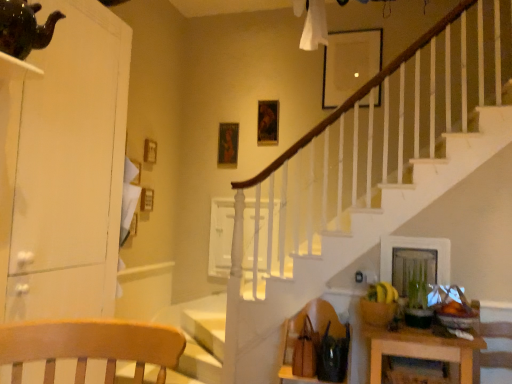
Question: Is green matte plant at lower right taller or shorter than wooden table at lower right?

Choices:
 (A) short
 (B) tall

Answer: (A)

Question: From a real-world perspective, is green matte plant at lower right above or below wooden table at lower right?

Choices:
 (A) above
 (B) below

Answer: (A)

Question: Estimate the real-world distances between objects in this image. Which object is farther from the wooden picture frame at upper center, placed as the first picture frame when sorted from right to left?

Choices:
 (A) brown leather armchair at lower right
 (B) wooden table at lower right
 (C) green matte plant at lower right
 (D) metallic gold picture frame at upper center, marked as the third picture frame in a front-to-back arrangement
 (E) white glossy dresser at left

Answer: (E)

Question: Which object is positioned closest to the metallic gold picture frame at upper center, marked as the third picture frame in a front-to-back arrangement?

Choices:
 (A) brown leather armchair at lower right
 (B) wooden picture frame at upper center, which is counted as the 3th picture frame, starting from the back
 (C) white glossy dresser at left
 (D) wooden table at lower right
 (E) wooden picture frame at upper center, which appears as the 2th picture frame when viewed from the front

Answer: (E)